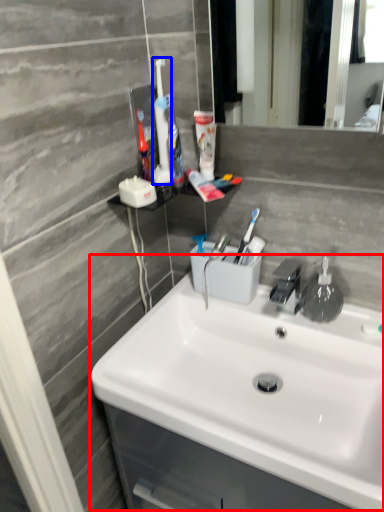
Question: Among these objects, which one is farthest to the camera, sink (highlighted by a red box) or toothbrush (highlighted by a blue box)?

Choices:
 (A) sink
 (B) toothbrush

Answer: (B)